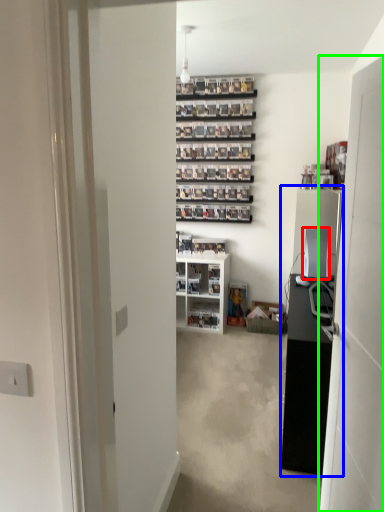
Question: Which object is positioned closest to appliance (highlighted by a red box)? Select from entertainment center (highlighted by a blue box) and door (highlighted by a green box).

Choices:
 (A) entertainment center
 (B) door

Answer: (A)